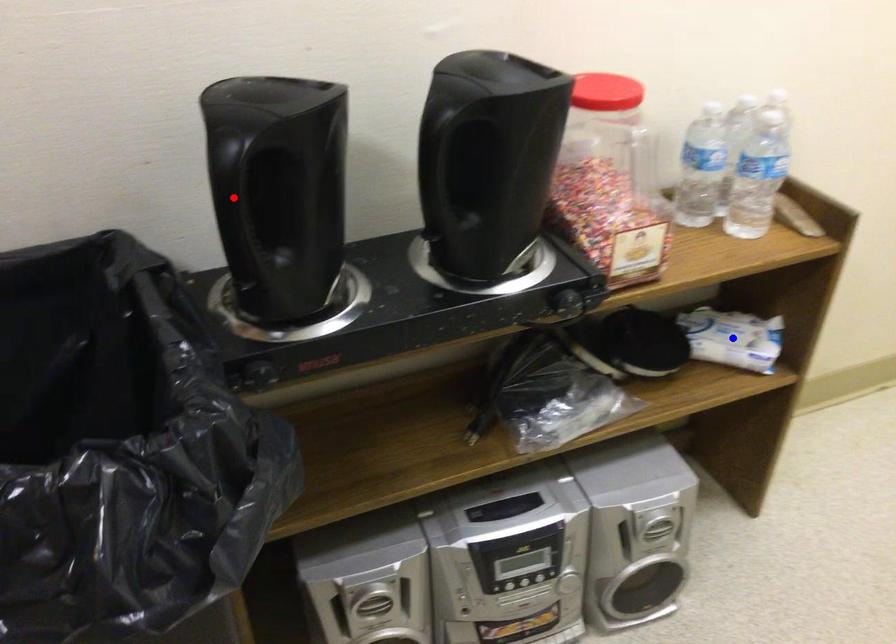
Question: In the image, two points are highlighted. Which point is nearer to the camera? Reply with the corresponding letter.

Choices:
 (A) blue point
 (B) red point

Answer: (B)